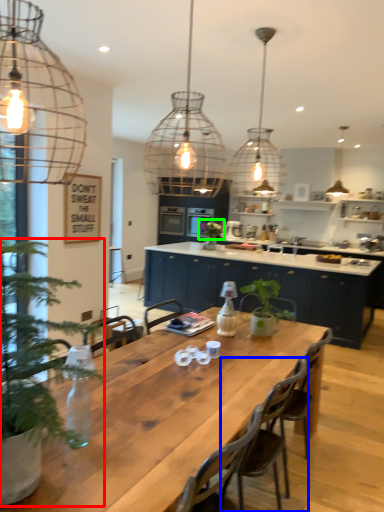
Question: Which object is the closest to the houseplant (highlighted by a red box)? Choose among these: chair (highlighted by a blue box) or plant (highlighted by a green box).

Choices:
 (A) chair
 (B) plant

Answer: (A)